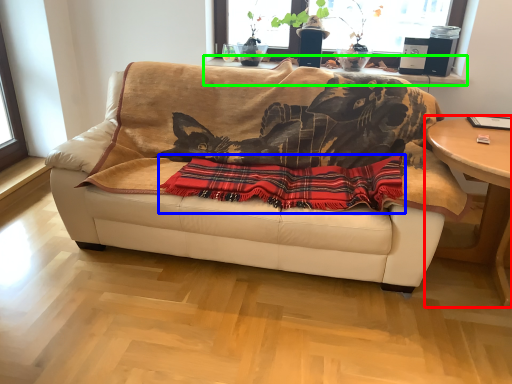
Question: Based on their relative distances, which object is nearer to table (highlighted by a red box)? Choose from plaid (highlighted by a blue box) and window sill (highlighted by a green box).

Choices:
 (A) plaid
 (B) window sill

Answer: (A)